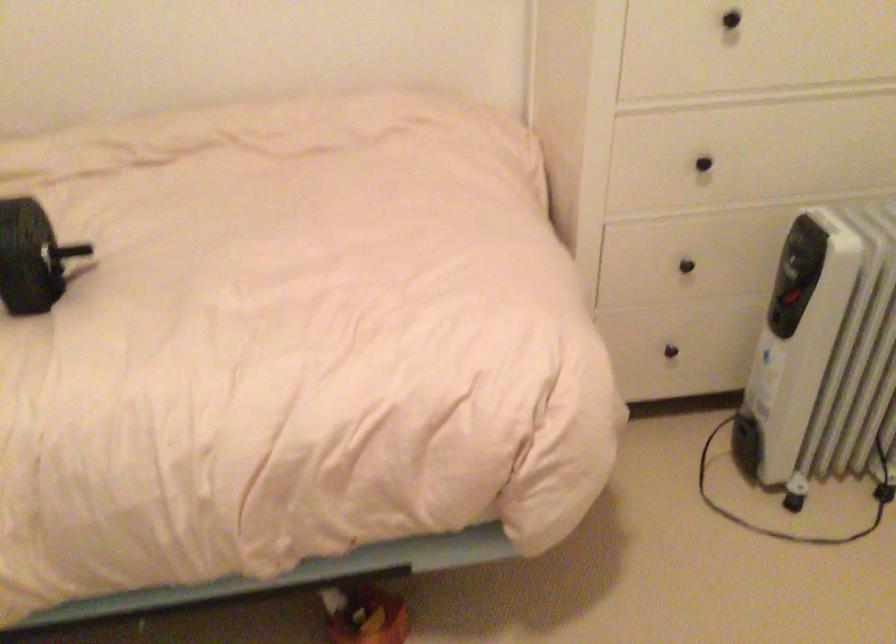
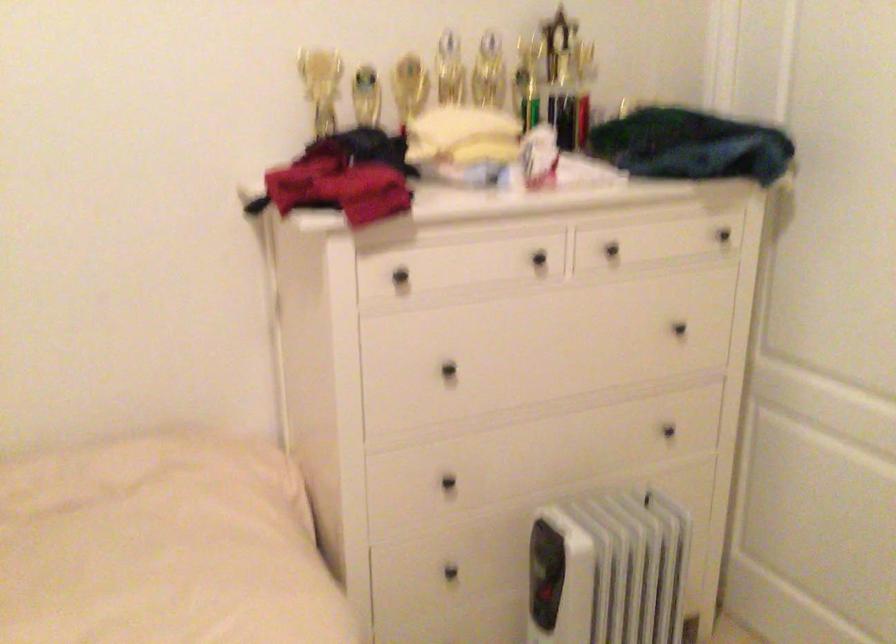
Question: Which direction would the cameraman need to move to produce the second image? Reply with the corresponding letter.

Choices:
 (A) Left
 (B) Right
 (C) Forward
 (D) Backward

Answer: (D)